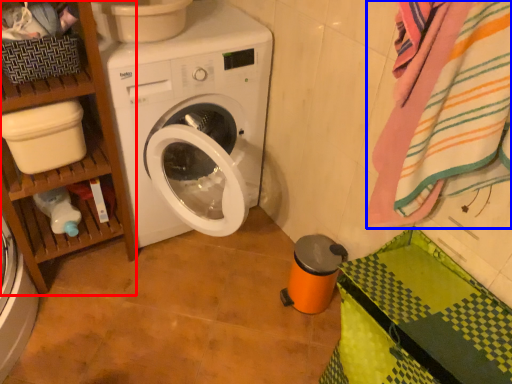
Question: Which of the following is the closest to the observer, shelf (highlighted by a red box) or bath towel (highlighted by a blue box)?

Choices:
 (A) shelf
 (B) bath towel

Answer: (B)